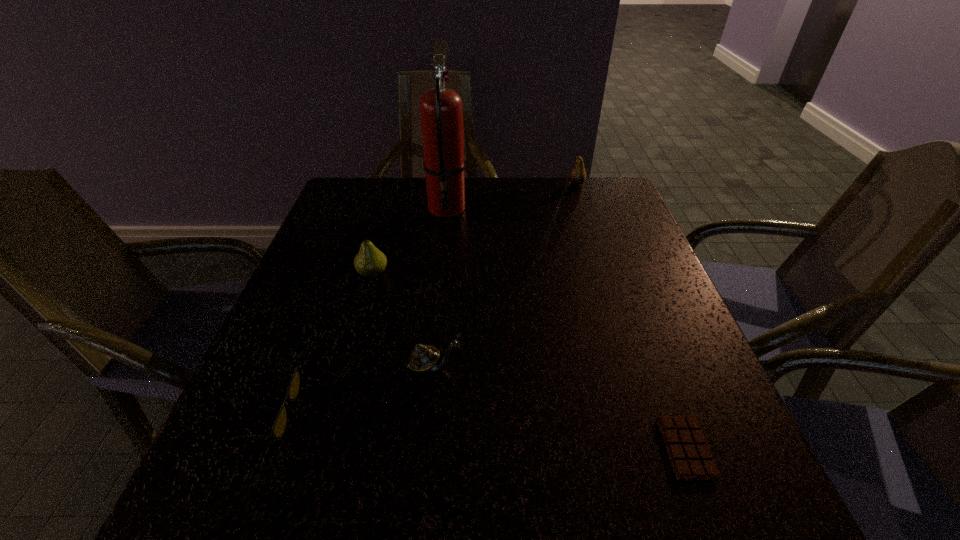
In order to click on free space between the sunglasses and the snail in this screenshot , I will do `click(353, 389)`.

You are a GUI agent. You are given a task and a screenshot of the screen. Output one action in this format:
    pyautogui.click(x=<x>, y=<y>)
    Task: Click on the free space between the fourth farthest object and the right pear
    This screenshot has width=960, height=540.
    Given the screenshot: What is the action you would take?
    pyautogui.click(x=506, y=275)

Where is `object that is the fifth closest to the tallest object`? The height and width of the screenshot is (540, 960). object that is the fifth closest to the tallest object is located at coordinates (689, 453).

Select which object is the fifth closest to the snail. Please provide its 2D coordinates. Your answer should be formatted as a tuple, i.e. [(x, y)], where the tuple contains the x and y coordinates of a point satisfying the conditions above.

[(577, 176)]

You are a GUI agent. You are given a task and a screenshot of the screen. Output one action in this format:
    pyautogui.click(x=<x>, y=<y>)
    Task: Click on the vacant area in the image that satisfies the following two spatial constraints: 1. on the face of the candy bar; 2. on the left side of the snail
    
    Given the screenshot: What is the action you would take?
    pyautogui.click(x=427, y=448)

Find the location of `vacant space that satisfies the following two spatial constraints: 1. on the front side of the nearer pear; 2. on the left side of the shortest object`. vacant space that satisfies the following two spatial constraints: 1. on the front side of the nearer pear; 2. on the left side of the shortest object is located at coordinates (324, 448).

The height and width of the screenshot is (540, 960). What are the coordinates of `vacant region that satisfies the following two spatial constraints: 1. on the face of the fourth farthest object; 2. on the left side of the shortest object` in the screenshot? It's located at (427, 448).